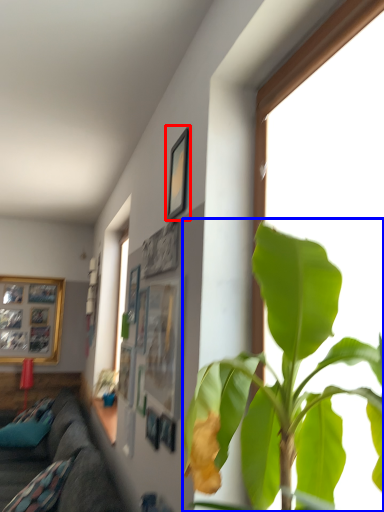
Question: Which object appears closest to the camera in this image, picture frame (highlighted by a red box) or houseplant (highlighted by a blue box)?

Choices:
 (A) picture frame
 (B) houseplant

Answer: (B)